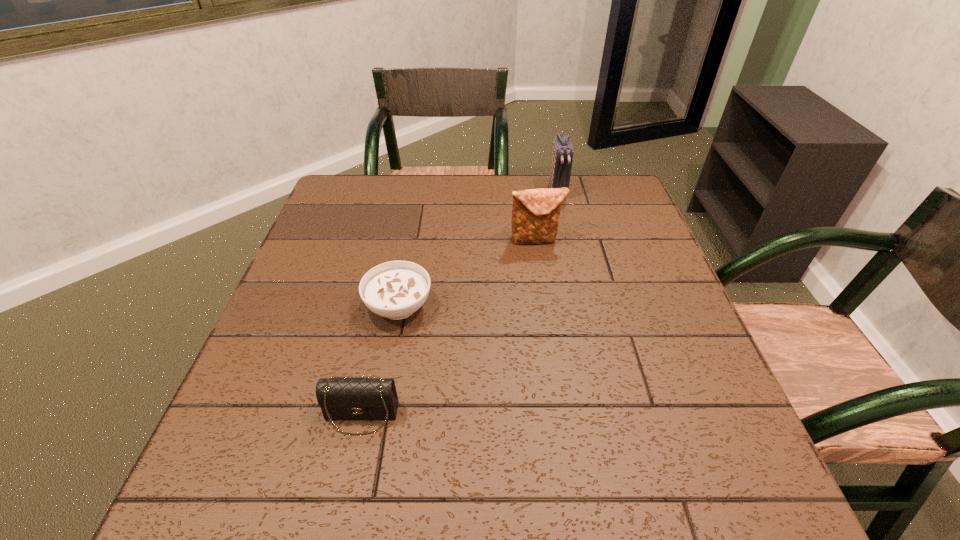
Where is `object at the far edge`? object at the far edge is located at coordinates (562, 159).

Where is `blank space at the far edge of the desktop`? The height and width of the screenshot is (540, 960). blank space at the far edge of the desktop is located at coordinates (x=435, y=179).

At what (x,y) coordinates should I click in order to perform the action: click on vacant space at the near edge. Please return your answer as a coordinate pair (x, y). This screenshot has height=540, width=960. Looking at the image, I should click on (459, 460).

You are a GUI agent. You are given a task and a screenshot of the screen. Output one action in this format:
    pyautogui.click(x=<x>, y=<y>)
    Task: Click on the vacant space at the left edge of the desktop
    
    Given the screenshot: What is the action you would take?
    pyautogui.click(x=311, y=334)

Locate an element on the screen. This screenshot has width=960, height=540. vacant space at the right edge of the desktop is located at coordinates (642, 284).

In the image, there is a desktop. Where is `free space at the far left corner`? free space at the far left corner is located at coordinates (335, 176).

You are a GUI agent. You are given a task and a screenshot of the screen. Output one action in this format:
    pyautogui.click(x=<x>, y=<y>)
    Task: Click on the vacant space at the near left corner of the desktop
    
    Given the screenshot: What is the action you would take?
    pyautogui.click(x=232, y=460)

Identify the location of free space at the far right corner. (607, 188).

Where is `vacant region at the near right corner of the desktop`? The height and width of the screenshot is (540, 960). vacant region at the near right corner of the desktop is located at coordinates (750, 472).

Where is `vacant space that is in between the farthest object and the leftmost clutch bag`? vacant space that is in between the farthest object and the leftmost clutch bag is located at coordinates (459, 303).